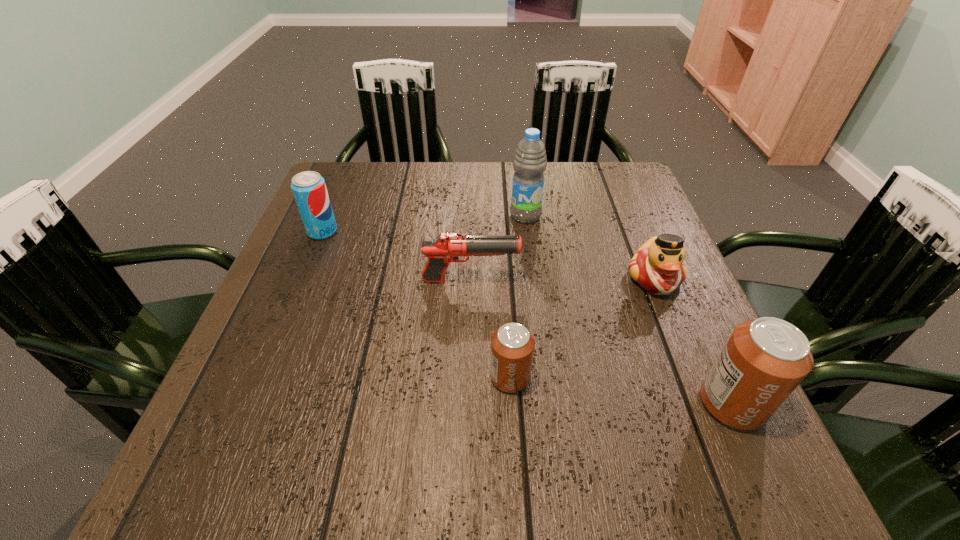
Where is `free space at the left edge`? This screenshot has width=960, height=540. free space at the left edge is located at coordinates (327, 297).

Identify the location of free spot at the right edge of the desktop. The image size is (960, 540). (648, 210).

In the image, there is a desktop. Where is `vacant space at the far left corner`? The image size is (960, 540). vacant space at the far left corner is located at coordinates (359, 202).

I want to click on vacant region at the near left corner, so click(226, 386).

In the image, there is a desktop. Where is `blank space at the far right corner`? blank space at the far right corner is located at coordinates (615, 205).

Locate an element on the screen. Image resolution: width=960 pixels, height=540 pixels. vacant area that lies between the left can and the second tallest object is located at coordinates (621, 390).

Find the location of a particular element. The image size is (960, 540). free spot between the water bottle and the leftmost object is located at coordinates (424, 224).

I want to click on vacant space that is in between the second tallest object and the shorter can, so click(x=621, y=390).

Where is `unoccupied area between the leftmost object and the taller can`? The height and width of the screenshot is (540, 960). unoccupied area between the leftmost object and the taller can is located at coordinates (527, 318).

Locate an element on the screen. This screenshot has height=540, width=960. free spot between the second tallest object and the gun is located at coordinates (601, 342).